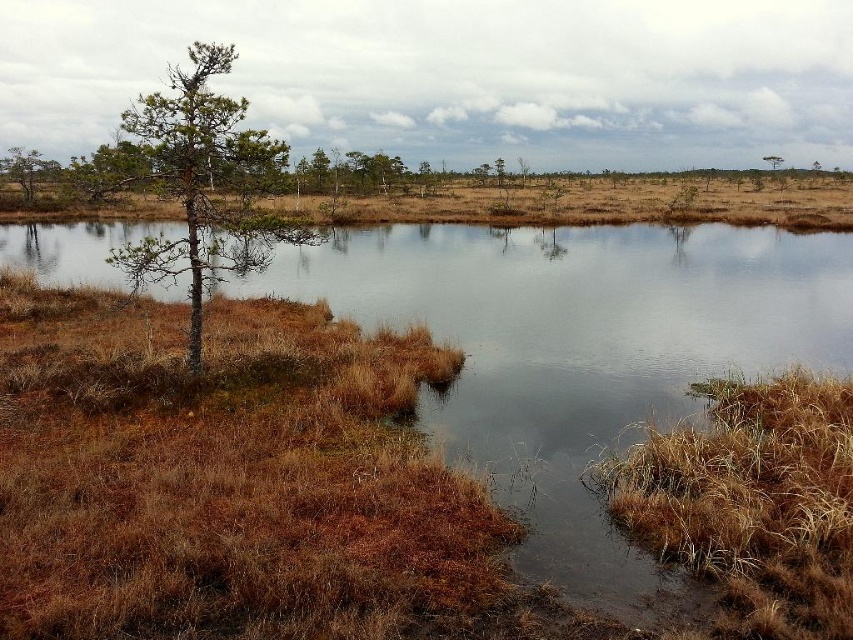
Question: Is brown grassy lake at center bigger than green matte tree at center?

Choices:
 (A) no
 (B) yes

Answer: (B)

Question: Estimate the real-world distances between objects in this image. Which object is closer to the green matte tree at left?

Choices:
 (A) green needle-like tree at left
 (B) brown grassy lake at center

Answer: (A)

Question: Can you confirm if green matte tree at center is thinner than green matte tree at upper right?

Choices:
 (A) no
 (B) yes

Answer: (B)

Question: Which point is farther to the camera?

Choices:
 (A) green matte tree at center
 (B) green matte tree at left
 (C) green matte tree at upper right
 (D) brown grassy lake at center

Answer: (C)

Question: Based on their relative distances, which object is farther from the brown grassy lake at center?

Choices:
 (A) green needle-like tree at left
 (B) green matte tree at center
 (C) green matte tree at left
 (D) green matte tree at upper right

Answer: (D)

Question: Is green matte tree at left behind green matte tree at center?

Choices:
 (A) yes
 (B) no

Answer: (B)